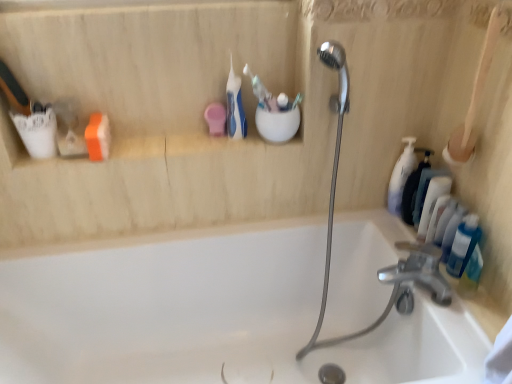
I want to click on free spot to the left of blue translucent bottle at right, the fourth toiletry when ordered from left to right, so click(429, 300).